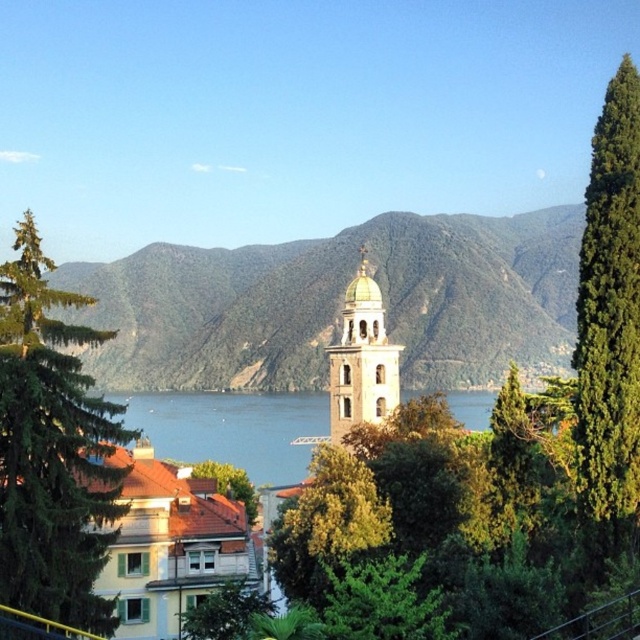
You are an architect designing a new park layout. You need to place a statue exactly halfway between the gold domed bell tower at center and the green leafy tree at lower center. Based on their widths, which object will the statue be closer to?

The statue will be closer to the gold domed bell tower at center because it has a lesser width compared to the green leafy tree at lower center, meaning the distance between them is determined by the narrower object.

You are an artist planning to paint this landscape. You want to ensure the green leafy tree at lower center and the gold domed bell tower at center are positioned correctly according to their spatial relationship. Which object should appear in front of the other in your painting?

The gold domed bell tower at center should appear in front of the green leafy tree at lower center because the tree is behind the tower according to the description.